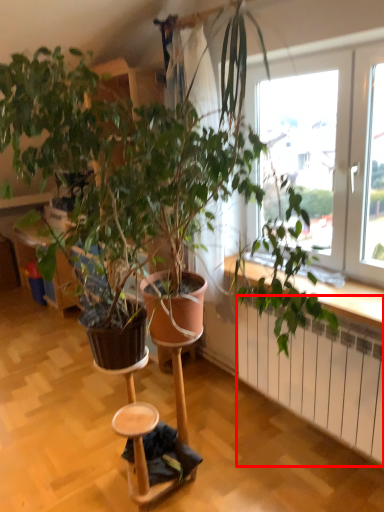
Question: From the image's perspective, what is the correct spatial relationship of radiator (annotated by the red box) in relation to step stool?

Choices:
 (A) above
 (B) below

Answer: (A)